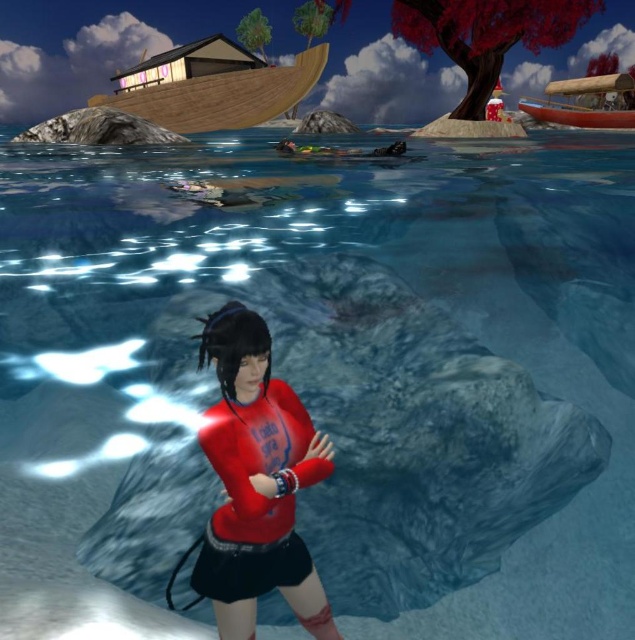
Does point (231, 461) come behind point (585, 109)?

No, (231, 461) is in front of (585, 109).

Between point (298, 602) and point (519, 109), which one is positioned in front?

Point (298, 602) is more forward.

What do you see at coordinates (257, 481) in the screenshot? The width and height of the screenshot is (635, 640). I see `shiny red wetsuit at center` at bounding box center [257, 481].

Find the location of `shiny red wetsuit at center`. shiny red wetsuit at center is located at coordinates (257, 481).

Which is more to the right, shiny red wetsuit at center or wooden boat at upper left?

shiny red wetsuit at center is more to the right.

Based on the photo, which is more to the left, shiny red wetsuit at center or wooden boat at upper left?

Positioned to the left is wooden boat at upper left.

Who is more distant from viewer, (283, 394) or (241, 99)?

The point (241, 99) is more distant.

Find the location of a particular element. The width and height of the screenshot is (635, 640). shiny red wetsuit at center is located at coordinates (257, 481).

Which is more to the right, wooden boat at upper left or wooden canoe at upper right?

wooden canoe at upper right is more to the right.

In the scene shown: Does wooden boat at upper left appear over wooden canoe at upper right?

No.

Which is behind, point (258, 83) or point (629, 120)?

Positioned behind is point (629, 120).

I want to click on wooden boat at upper left, so [x=215, y=88].